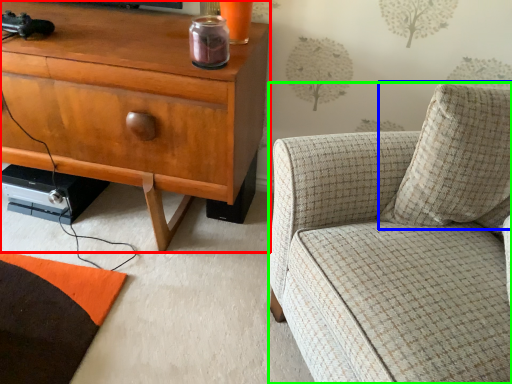
Question: Which is nearer to the cabinetry (highlighted by a red box)? pillow (highlighted by a blue box) or chair (highlighted by a green box).

Choices:
 (A) pillow
 (B) chair

Answer: (B)